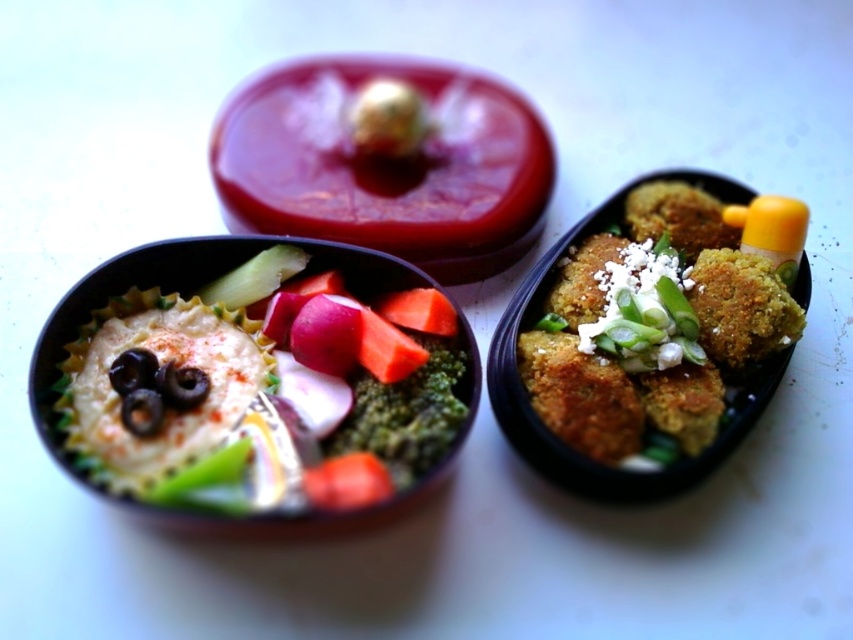
Can you confirm if golden crispy balls at right is bigger than green matte broccoli at center?

Correct, golden crispy balls at right is larger in size than green matte broccoli at center.

What do you see at coordinates (654, 326) in the screenshot? I see `golden crispy balls at right` at bounding box center [654, 326].

This screenshot has height=640, width=853. I want to click on golden crispy balls at right, so click(x=654, y=326).

The height and width of the screenshot is (640, 853). I want to click on golden crispy balls at right, so click(x=654, y=326).

Can you confirm if green leafytexturedsalad at left is positioned above golden crispy balls at right?

No.

Which is in front, point (201, 490) or point (718, 250)?

Point (201, 490) is in front.

Where is `green leafytexturedsalad at left`? green leafytexturedsalad at left is located at coordinates (253, 378).

Is green leafytexturedsalad at left below green matte broccoli at center?

Incorrect, green leafytexturedsalad at left is not positioned below green matte broccoli at center.

Which is in front, point (410, 476) or point (433, 451)?

Point (410, 476)

Is point (286, 278) farther from camera compared to point (419, 342)?

Yes, it is.

Locate an element on the screen. The image size is (853, 640). green leafytexturedsalad at left is located at coordinates (253, 378).